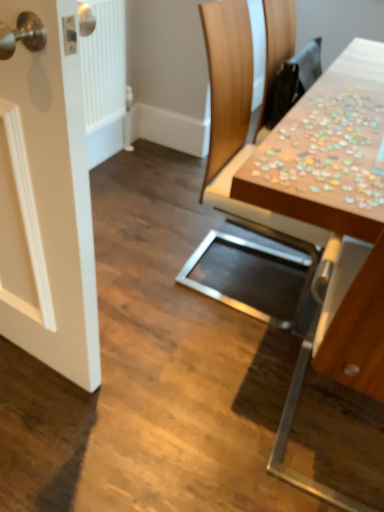
Question: Based on their positions, is wooden puzzle pieces at upper right located to the left or right of wooden puzzle pieces at upper right?

Choices:
 (A) left
 (B) right

Answer: (B)

Question: In terms of size, does wooden puzzle pieces at upper right appear bigger or smaller than wooden puzzle pieces at upper right?

Choices:
 (A) big
 (B) small

Answer: (B)

Question: Based on their relative distances, which object is farther from the wooden puzzle pieces at upper right?

Choices:
 (A) wooden chair at upper right
 (B) wooden puzzle pieces at upper right

Answer: (A)

Question: Based on their relative distances, which object is nearer to the wooden puzzle pieces at upper right?

Choices:
 (A) wooden puzzle pieces at upper right
 (B) wooden chair at upper right

Answer: (A)